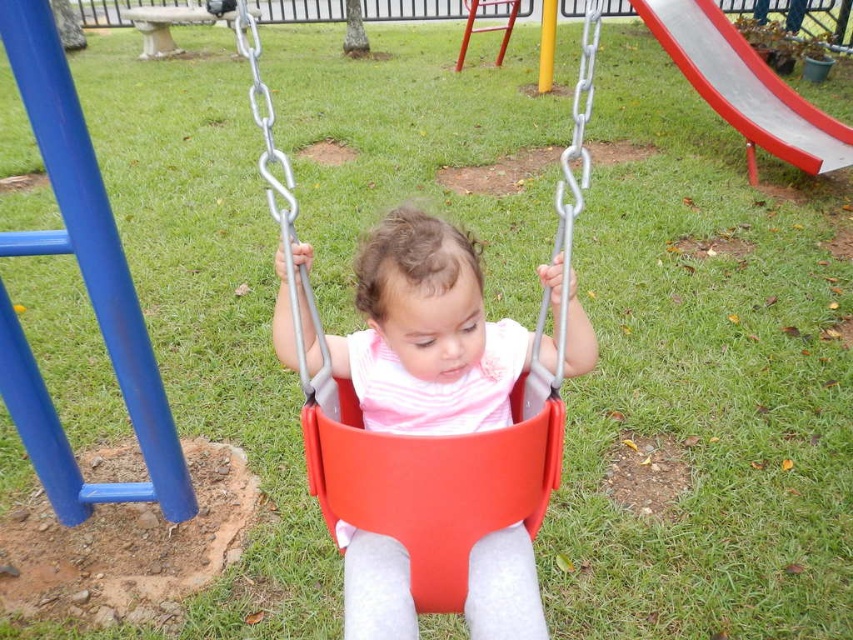
Does matte plastic swing at center have a lesser width compared to smooth plastic slide at upper right?

Correct, matte plastic swing at center's width is less than smooth plastic slide at upper right's.

Is point (419, 545) positioned after point (787, 90)?

No, (419, 545) is in front of (787, 90).

At what (x,y) coordinates should I click in order to perform the action: click on matte plastic swing at center. Please return your answer as a coordinate pair (x, y). This screenshot has height=640, width=853. Looking at the image, I should click on (450, 436).